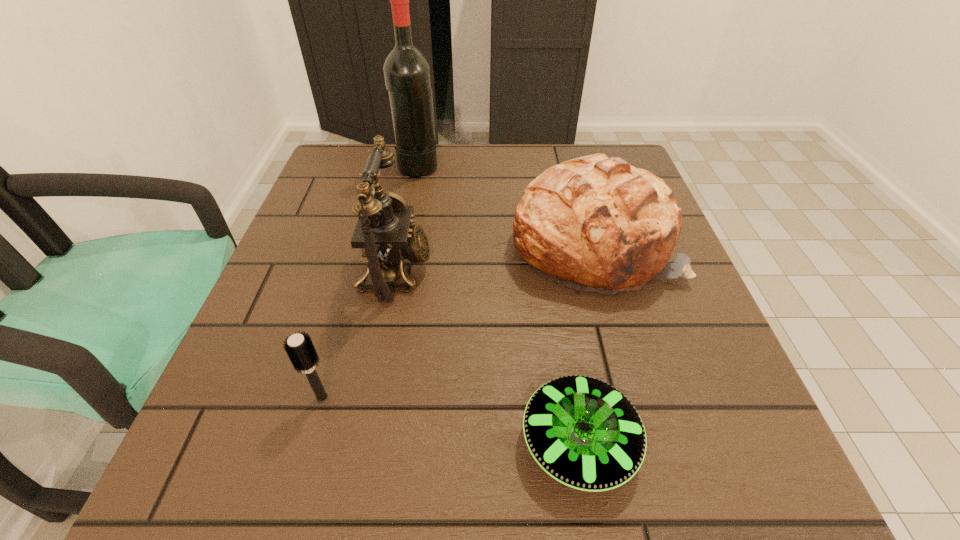
You are a GUI agent. You are given a task and a screenshot of the screen. Output one action in this format:
    pyautogui.click(x=<x>, y=<y>)
    Task: Click on the blank space located 0.230m on the left of the shortest object
    The height and width of the screenshot is (540, 960).
    Given the screenshot: What is the action you would take?
    pyautogui.click(x=356, y=442)

This screenshot has width=960, height=540. What are the coordinates of `object present at the far edge` in the screenshot? It's located at (407, 74).

Locate an element on the screen. object at the near edge is located at coordinates (583, 432).

Locate an element on the screen. The image size is (960, 540). object present at the left edge is located at coordinates (300, 349).

Identify the location of object located at the right edge. The image size is (960, 540). (593, 223).

The image size is (960, 540). I want to click on blank space at the far edge of the desktop, so click(x=494, y=168).

Where is `vacant space at the left edge of the desktop`? vacant space at the left edge of the desktop is located at coordinates (266, 330).

Where is `free point at the right edge`? free point at the right edge is located at coordinates (676, 323).

Locate an element on the screen. vacant region at the far left corner is located at coordinates (346, 150).

The height and width of the screenshot is (540, 960). Identify the location of free space at the near right corner. (666, 487).